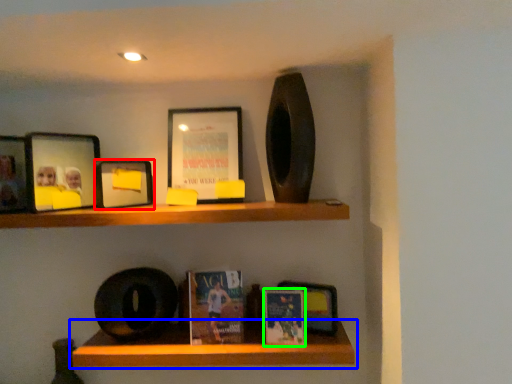
Question: Which is nearer to the picture frame (highlighted by a red box)? shelf (highlighted by a blue box) or paperback book (highlighted by a green box).

Choices:
 (A) shelf
 (B) paperback book

Answer: (A)